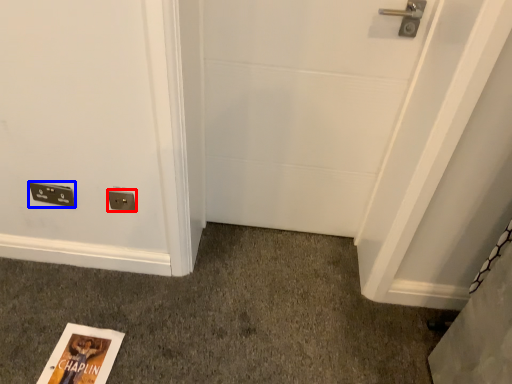
Question: Which object appears closest to the camera in this image, electric outlet (highlighted by a red box) or light switch (highlighted by a blue box)?

Choices:
 (A) electric outlet
 (B) light switch

Answer: (A)